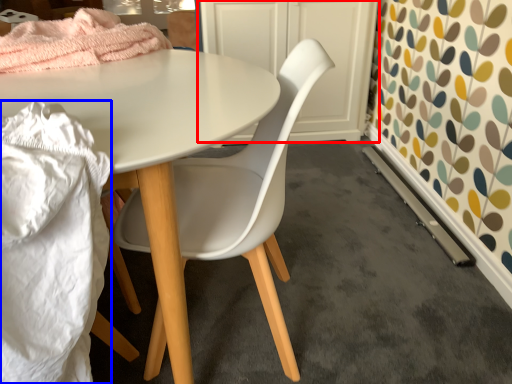
Question: Which point is further to the camera, cabinetry (highlighted by a red box) or material (highlighted by a blue box)?

Choices:
 (A) cabinetry
 (B) material

Answer: (A)